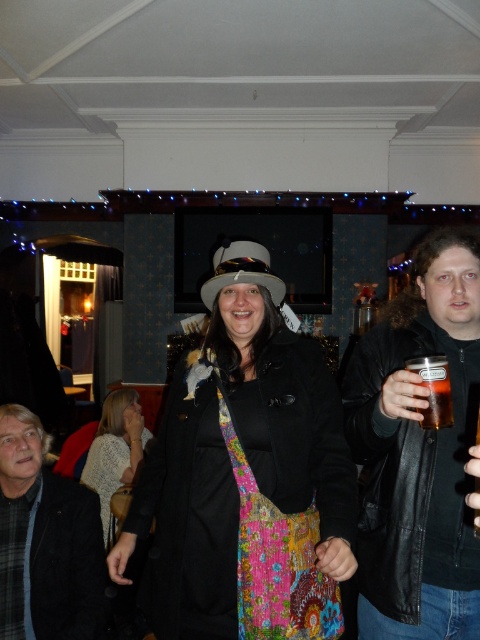
Describe the element at coordinates (54, 536) in the screenshot. I see `dark gray woolen jacket at center` at that location.

The image size is (480, 640). In order to click on dark gray woolen jacket at center in this screenshot , I will do `click(54, 536)`.

Which is above, leather jacket at right or dark gray woolen jacket at center?

Positioned higher is leather jacket at right.

Does leather jacket at right come behind dark gray woolen jacket at center?

No, it is in front of dark gray woolen jacket at center.

Image resolution: width=480 pixels, height=640 pixels. What are the coordinates of `leather jacket at right` in the screenshot? It's located at (419, 452).

Does dark gray woolen jacket at center have a lesser width compared to translucent plastic cup at right?

No, dark gray woolen jacket at center is not thinner than translucent plastic cup at right.

Who is lower down, dark gray woolen jacket at center or translucent plastic cup at right?

dark gray woolen jacket at center is below.

Locate an element on the screen. This screenshot has height=640, width=480. dark gray woolen jacket at center is located at coordinates (54, 536).